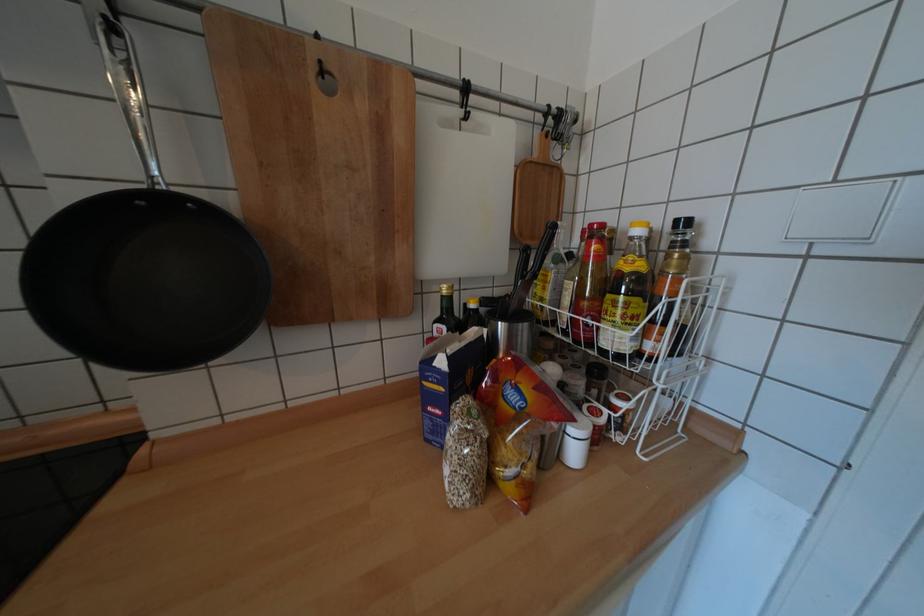
The image size is (924, 616). What are the coordinates of `yellow bottle cap` in the screenshot? It's located at (639, 224).